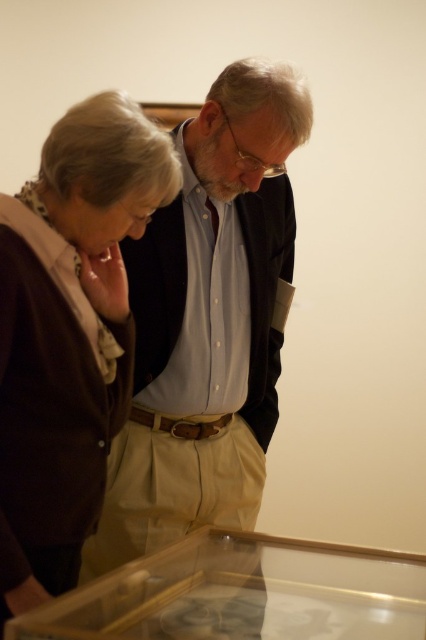
Question: Which of the following is the farthest from the observer?

Choices:
 (A) brown cardigan at left
 (B) transparent glass case at lower center

Answer: (A)

Question: Estimate the real-world distances between objects in this image. Which object is farther from the brown cardigan at left?

Choices:
 (A) transparent glass case at lower center
 (B) light blue button-down shirt at center

Answer: (A)

Question: Which is farther from the light blue button-down shirt at center?

Choices:
 (A) transparent glass case at lower center
 (B) brown cardigan at left

Answer: (A)

Question: Is light blue button-down shirt at center behind transparent glass case at lower center?

Choices:
 (A) yes
 (B) no

Answer: (A)

Question: Can you confirm if brown cardigan at left is thinner than transparent glass case at lower center?

Choices:
 (A) yes
 (B) no

Answer: (A)

Question: Is brown cardigan at left smaller than transparent glass case at lower center?

Choices:
 (A) yes
 (B) no

Answer: (B)